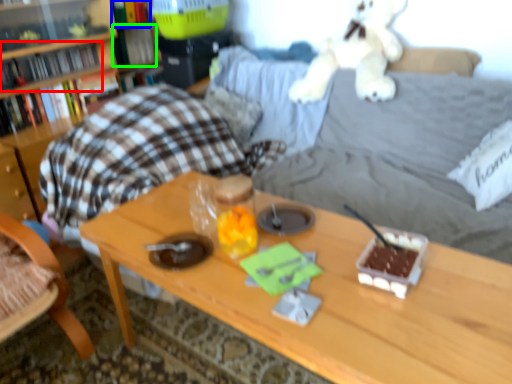
Question: Which object is the closest to the book (highlighted by a red box)? Choose among these: book (highlighted by a blue box) or book (highlighted by a green box).

Choices:
 (A) book
 (B) book

Answer: (B)